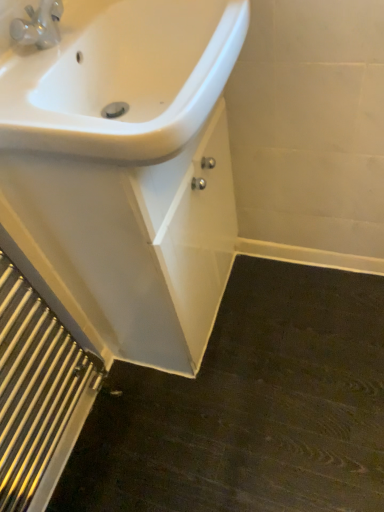
Question: From a real-world perspective, is polished silver radiator at lower left on top of white glossy sink at upper left?

Choices:
 (A) no
 (B) yes

Answer: (A)

Question: Considering the relative positions of polished silver radiator at lower left and white glossy sink at upper left in the image provided, is polished silver radiator at lower left to the left of white glossy sink at upper left from the viewer's perspective?

Choices:
 (A) no
 (B) yes

Answer: (B)

Question: Is white glossy sink at upper left inside polished silver radiator at lower left?

Choices:
 (A) yes
 (B) no

Answer: (B)

Question: Is polished silver radiator at lower left bigger than white glossy sink at upper left?

Choices:
 (A) yes
 (B) no

Answer: (B)

Question: Does polished silver radiator at lower left have a greater width compared to white glossy sink at upper left?

Choices:
 (A) no
 (B) yes

Answer: (A)

Question: Relative to white glossy sink at upper left, is polished silver radiator at lower left in front or behind?

Choices:
 (A) front
 (B) behind

Answer: (B)

Question: In terms of width, does polished silver radiator at lower left look wider or thinner when compared to white glossy sink at upper left?

Choices:
 (A) wide
 (B) thin

Answer: (B)

Question: Considering the positions of polished silver radiator at lower left and white glossy sink at upper left in the image, is polished silver radiator at lower left bigger or smaller than white glossy sink at upper left?

Choices:
 (A) big
 (B) small

Answer: (B)

Question: From a real-world perspective, relative to white glossy sink at upper left, is polished silver radiator at lower left vertically above or below?

Choices:
 (A) above
 (B) below

Answer: (B)

Question: From the image's perspective, is white glossy sink at upper left positioned above or below polished silver radiator at lower left?

Choices:
 (A) above
 (B) below

Answer: (A)

Question: Is white glossy sink at upper left to the left or to the right of polished silver radiator at lower left in the image?

Choices:
 (A) left
 (B) right

Answer: (B)

Question: From their relative heights in the image, would you say white glossy sink at upper left is taller or shorter than polished silver radiator at lower left?

Choices:
 (A) short
 (B) tall

Answer: (B)

Question: From a real-world perspective, is white glossy sink at upper left above or below polished silver radiator at lower left?

Choices:
 (A) above
 (B) below

Answer: (B)

Question: Is white glossy sink at upper left bigger or smaller than white glossy sink at upper left?

Choices:
 (A) big
 (B) small

Answer: (B)

Question: Would you say white glossy sink at upper left is inside or outside white glossy sink at upper left?

Choices:
 (A) outside
 (B) inside

Answer: (A)